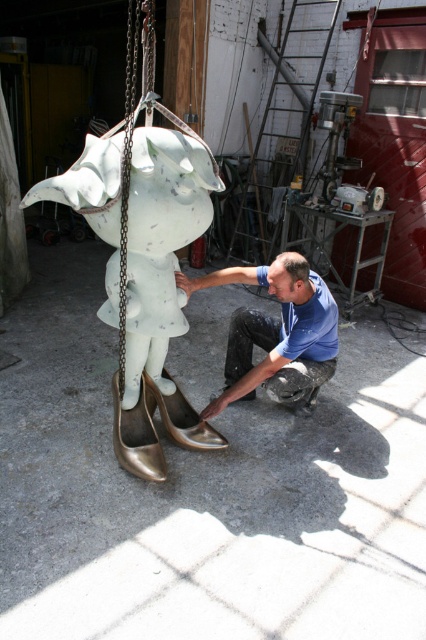
You are an observer in the workshop. You notice the blue matte shirt at lower center and the metallic chain at center. Which object is wider?

The blue matte shirt at lower center is wider than the metallic chain at center.

You are standing in the workshop and need to move from the point at coordinates [161,145] to the point at [307,346]. Which direction should you move in to reach the second point?

To move from point [161,145] to point [307,346], you should move backward since point [161,145] is in front of point [307,346].

You are an assistant helping in the workshop. You notice the blue matte shirt at lower center and the gold metallic shoe at lower left. Which object is wider?

The blue matte shirt at lower center is wider than the gold metallic shoe at lower left as its width surpasses the shoe.